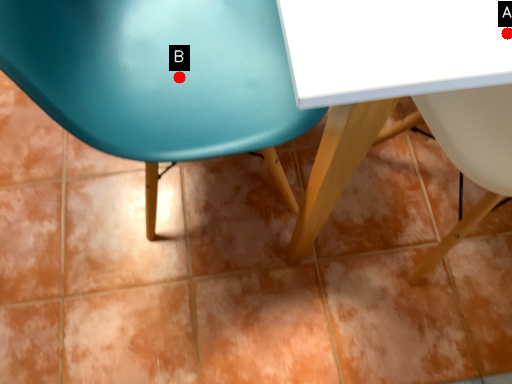
Question: Two points are circled on the image, labeled by A and B beside each circle. Among these points, which one is farthest from the camera?

Choices:
 (A) A is further
 (B) B is further

Answer: (B)